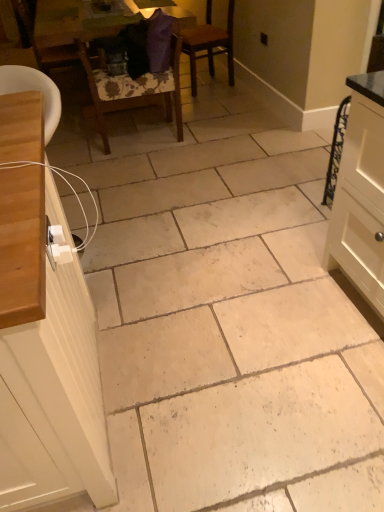
Identify the location of vacant space behind wooden chair at center, which is counted as the second chair, starting from the right. (135, 119).